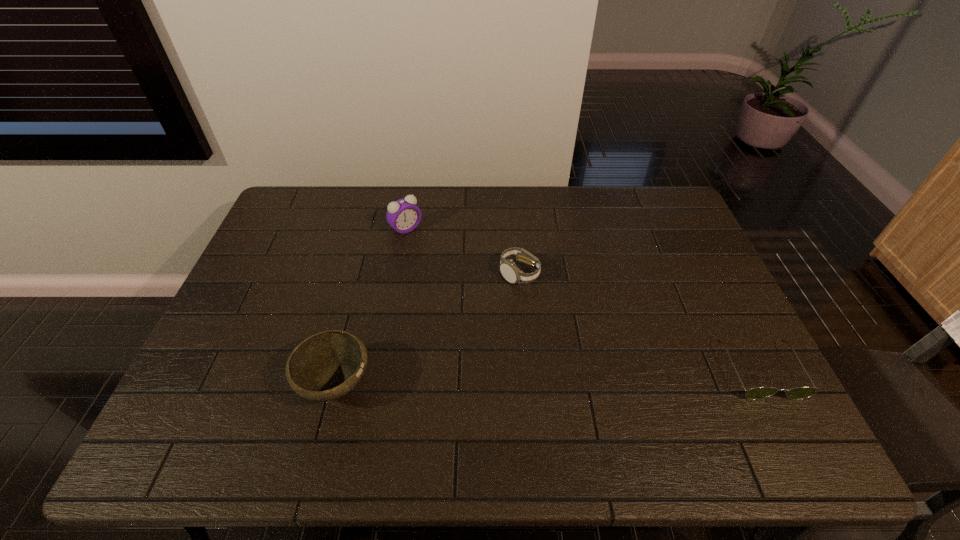
Where is `vacant space at the right edge of the desktop`? This screenshot has height=540, width=960. vacant space at the right edge of the desktop is located at coordinates (684, 315).

The height and width of the screenshot is (540, 960). Find the location of `vacant area at the far left corner`. vacant area at the far left corner is located at coordinates (300, 208).

In the image, there is a desktop. Identify the location of free space at the far right corner. (635, 209).

At what (x,y) coordinates should I click in order to perform the action: click on free space that is in between the watch and the bowl. Please return your answer as a coordinate pair (x, y). Looking at the image, I should click on (427, 329).

Locate an element on the screen. The height and width of the screenshot is (540, 960). free space between the sunglasses and the bowl is located at coordinates (548, 377).

Locate an element on the screen. vacant point located between the bowl and the farthest object is located at coordinates (372, 307).

I want to click on free space between the rightmost object and the third nearest object, so click(x=639, y=322).

The image size is (960, 540). Identify the location of free space between the farthest object and the third nearest object. (463, 251).

This screenshot has width=960, height=540. Identify the location of empty space that is in between the bowl and the watch. (427, 329).

The image size is (960, 540). Identify the location of vacant space in between the alarm clock and the third object from left to right. (463, 251).